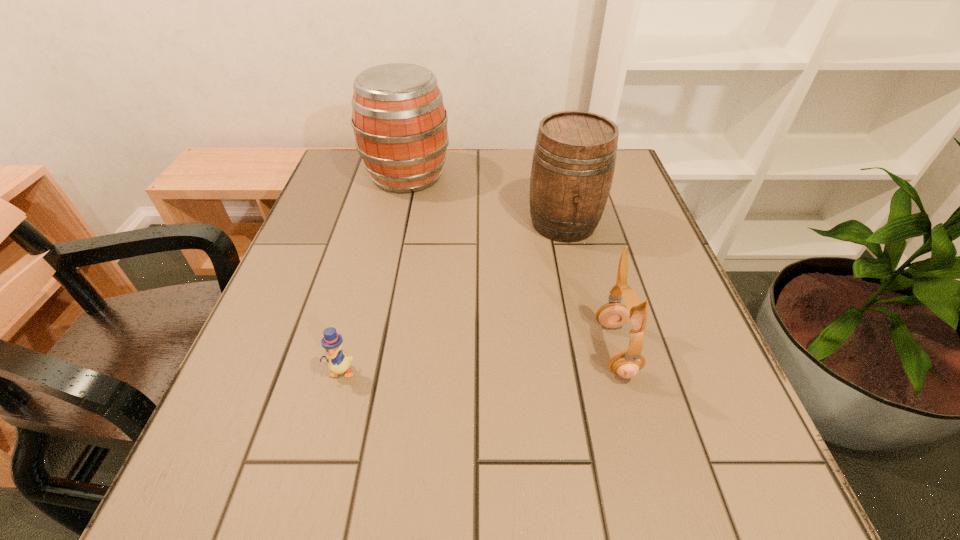
In the image, there is a desktop. At what (x,y) coordinates should I click in order to perform the action: click on vacant space at the left edge. Please return your answer as a coordinate pair (x, y). Looking at the image, I should click on (323, 407).

This screenshot has width=960, height=540. In the image, there is a desktop. What are the coordinates of `vacant space at the right edge` in the screenshot? It's located at (626, 205).

The height and width of the screenshot is (540, 960). Identify the location of vacant space at the far left corner of the desktop. (360, 180).

This screenshot has width=960, height=540. I want to click on vacant space at the near right corner of the desktop, so click(x=766, y=510).

Locate an element on the screen. vacant point located between the second farthest object and the shortest object is located at coordinates (452, 297).

Where is `vacant area that lies between the third tallest object and the shortest object`? The height and width of the screenshot is (540, 960). vacant area that lies between the third tallest object and the shortest object is located at coordinates (478, 360).

What are the coordinates of `vacant point located between the farthest object and the shortest object` in the screenshot? It's located at (374, 273).

This screenshot has height=540, width=960. I want to click on free space that is in between the farther cider and the shortest object, so click(374, 273).

I want to click on vacant area that lies between the duckling and the earphone, so coord(478,360).

Find the location of a particular element. This screenshot has height=540, width=960. free space between the farthest object and the nearer cider is located at coordinates (486, 199).